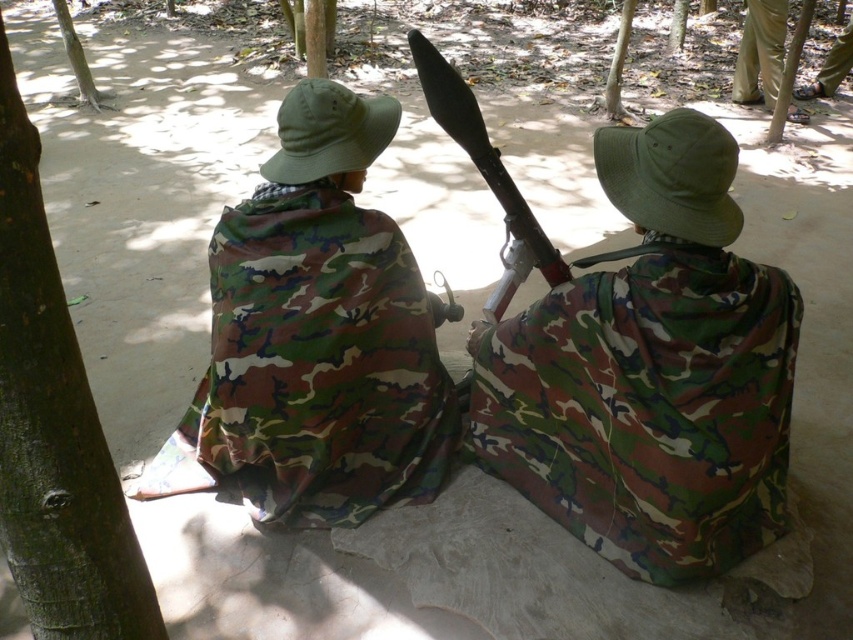
Is camouflage fabric at left bigger than matte black shotgun at center?

Indeed, camouflage fabric at left has a larger size compared to matte black shotgun at center.

Who is lower down, camouflage fabric at left or matte black shotgun at center?

camouflage fabric at left is below.

Which is in front, point (254, 477) or point (521, 216)?

Point (521, 216)

The height and width of the screenshot is (640, 853). I want to click on camouflage fabric at left, so (x=316, y=337).

Is smooth brown tree trunk at upper center below brown bark tree at upper left?

Yes, smooth brown tree trunk at upper center is below brown bark tree at upper left.

Between point (618, 88) and point (61, 1), which one is positioned behind?

The point (61, 1) is behind.

Where is `smooth brown tree trunk at upper center`? The width and height of the screenshot is (853, 640). smooth brown tree trunk at upper center is located at coordinates point(619,67).

Where is `smooth brown tree trunk at upper center`? smooth brown tree trunk at upper center is located at coordinates (619, 67).

Who is higher up, matte black shotgun at center or smooth brown tree trunk at upper center?

smooth brown tree trunk at upper center

Based on the photo, does matte black shotgun at center appear on the right side of smooth brown tree trunk at upper center?

Incorrect, matte black shotgun at center is not on the right side of smooth brown tree trunk at upper center.

Does point (419, 80) come closer to viewer compared to point (611, 86)?

That is True.

I want to click on matte black shotgun at center, so click(486, 176).